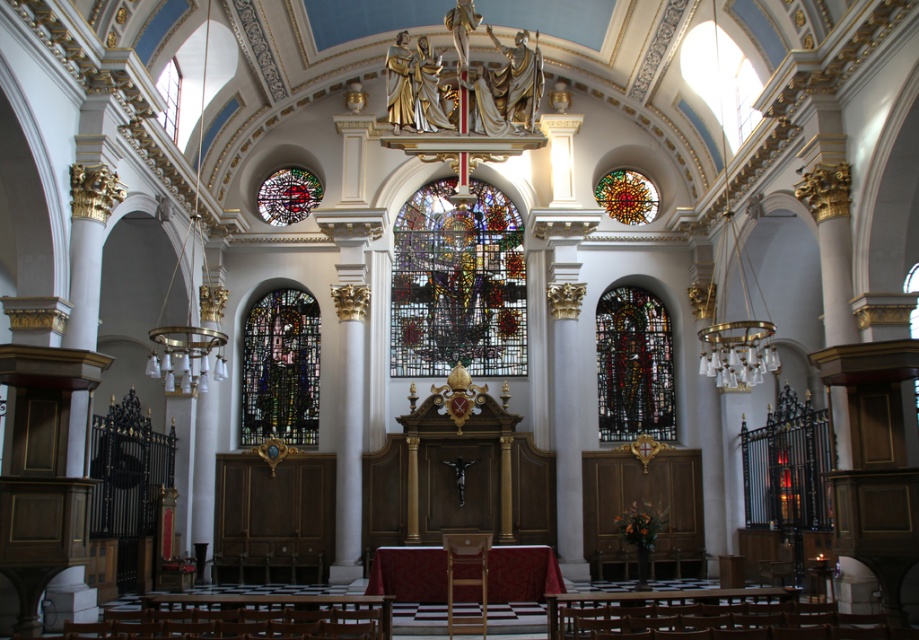
Question: Which is nearer to the multicolored stained glass at center left?

Choices:
 (A) wooden polished chair at center
 (B) stained glass window at center
 (C) multicolored stained glass at upper center

Answer: (C)

Question: Where is stained glass window at center located in relation to multicolored stained glass at center in the image?

Choices:
 (A) left
 (B) right

Answer: (A)

Question: Which is nearer to the multicolored stained glass at center left?

Choices:
 (A) multicolored stained glass at center
 (B) wooden polished chair at center
 (C) multicolored stained glass at upper center

Answer: (C)

Question: Is multicolored stained glass at center left bigger than multicolored stained glass at upper center?

Choices:
 (A) yes
 (B) no

Answer: (A)

Question: Which of the following is the closest to the observer?

Choices:
 (A) multicolored stained glass at center left
 (B) stained glass window at center

Answer: (A)

Question: Is multicolored stained glass at center below wooden polished chair at center?

Choices:
 (A) no
 (B) yes

Answer: (A)